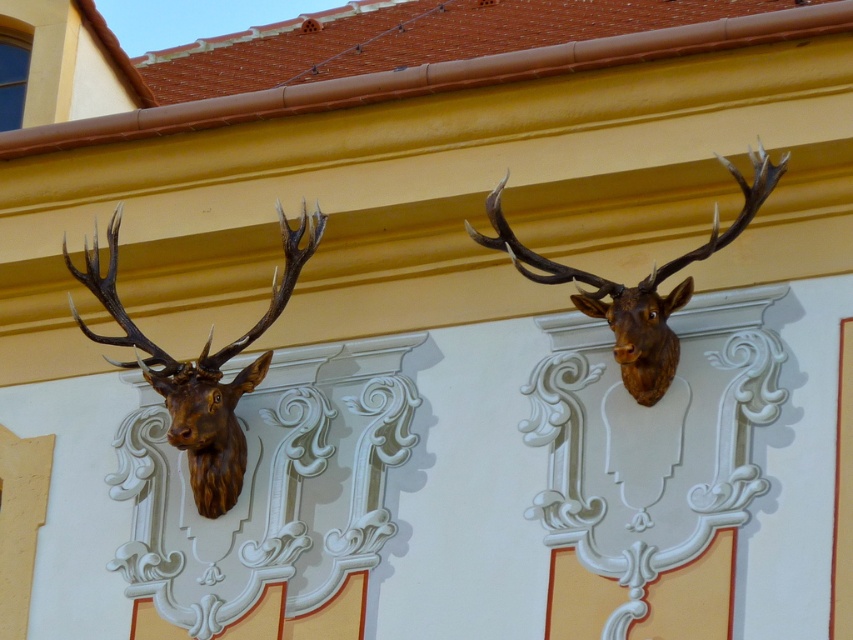
Question: Does brown wooden deer head at left appear over brown polished wood deer head at upper center?

Choices:
 (A) no
 (B) yes

Answer: (B)

Question: Among these points, which one is nearest to the camera?

Choices:
 (A) (210, 396)
 (B) (599, 296)

Answer: (B)

Question: Can you confirm if brown wooden deer head at left is positioned to the right of brown polished wood deer head at upper center?

Choices:
 (A) yes
 (B) no

Answer: (B)

Question: Which point is closer to the camera taking this photo?

Choices:
 (A) (648, 289)
 (B) (235, 440)

Answer: (A)

Question: In this image, where is brown wooden deer head at left located relative to brown polished wood deer head at upper center?

Choices:
 (A) right
 (B) left

Answer: (B)